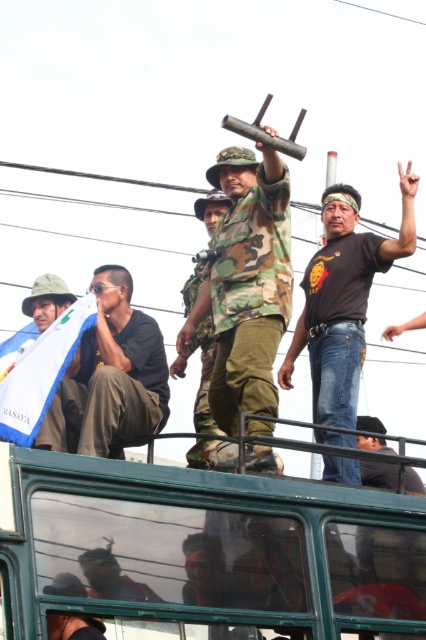
Question: Does camo fabric uniform at center have a smaller size compared to blue fabric flag at upper left?

Choices:
 (A) no
 (B) yes

Answer: (A)

Question: Estimate the real-world distances between objects in this image. Which object is closer to the green matte bus at upper center?

Choices:
 (A) black leather jacket at lower right
 (B) matte black shirt at left

Answer: (A)

Question: Which object is farther from the camera taking this photo?

Choices:
 (A) blue fabric flag at upper left
 (B) green matte bus at upper center
 (C) camouflage fabric uniform at center
 (D) black matte t-shirt at upper center

Answer: (D)

Question: Which object appears closest to the camera in this image?

Choices:
 (A) camouflage fabric uniform at center
 (B) black matte t-shirt at upper center
 (C) blue fabric flag at upper left

Answer: (A)

Question: Does blue fabric flag at upper left have a larger size compared to camouflage fabric uniform at center?

Choices:
 (A) no
 (B) yes

Answer: (A)

Question: Is black matte t-shirt at upper center to the left of black leather jacket at lower right from the viewer's perspective?

Choices:
 (A) no
 (B) yes

Answer: (B)